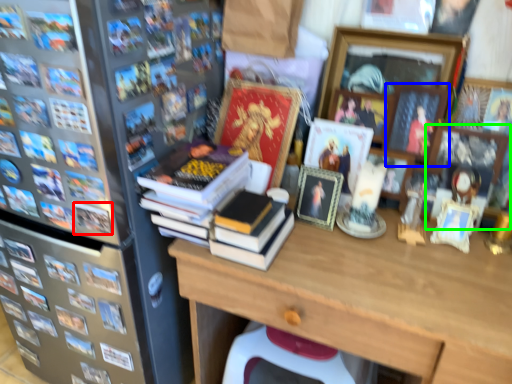
Question: Which is farther away from book (highlighted by a red box)? picture frame (highlighted by a blue box) or picture frame (highlighted by a green box)?

Choices:
 (A) picture frame
 (B) picture frame

Answer: (B)